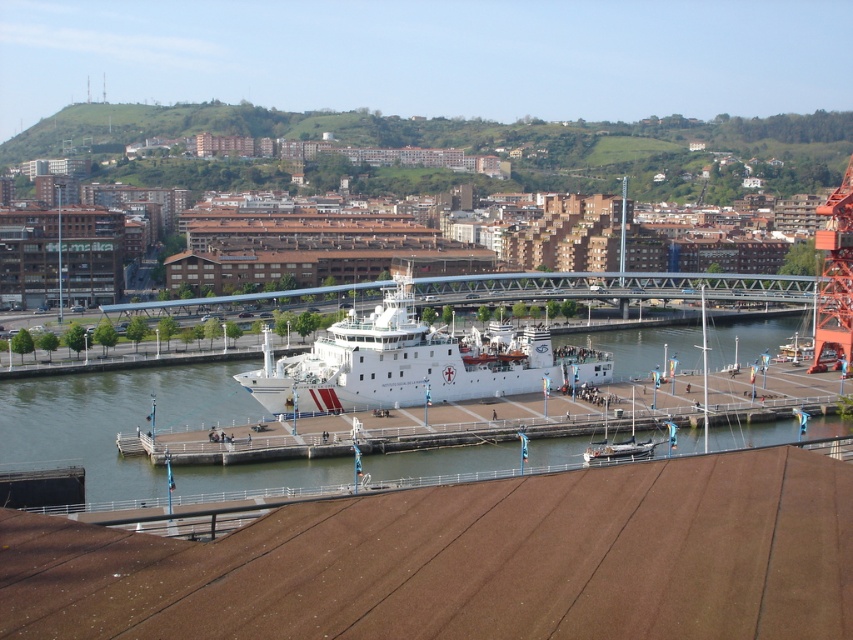
You are standing on the brown wooden dock at lower center and want to reach the wooden sailboat at center. Which direction should you move to get there?

You should move to the right because the brown wooden dock at lower center is to the left of the wooden sailboat at center, so moving right will take you towards it.

You are a photographer planning to capture the entire scene of the brown wooden dock at lower center and the clear water at center in one shot. Given that your camera has a limited field of view, which object should you focus on to ensure both are in frame?

The clear water at center has a larger size than the brown wooden dock at lower center, so focusing on the clear water at center will ensure both objects are within the camera frame.

You are standing at the edge of the brown wooden dock at lower center. You want to walk towards the white ship docked at the pier. In which direction should you move relative to your current position?

Since the brown wooden dock at lower center is positioned at point (471, 561), you should move towards the ship by heading towards the direction where the coordinates decrease, as the ship is docked at the pier closer to the shore. However, without specific coordinate data for the ship, the general direction would be towards the pier where the gangway connects to the ship.